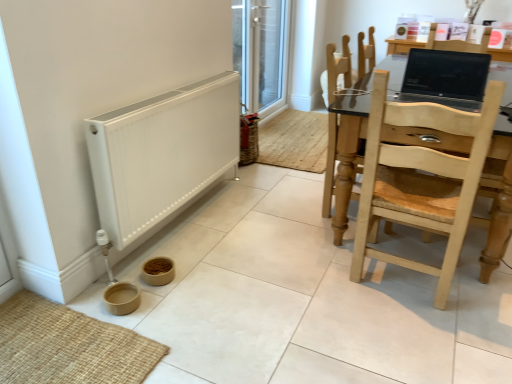
This screenshot has width=512, height=384. Describe the element at coordinates (445, 78) in the screenshot. I see `matte black laptop at upper right` at that location.

What do you see at coordinates (260, 51) in the screenshot? I see `transparent glass screen door at upper center` at bounding box center [260, 51].

Measure the distance between transparent glass screen door at upper center and camera.

The depth of transparent glass screen door at upper center is 10.62 feet.

You are a GUI agent. You are given a task and a screenshot of the screen. Output one action in this format:
    pyautogui.click(x=<x>, y=<y>)
    Task: Click on the light wood chair at right, the first chair in the front-to-back sequence
    The image size is (512, 384).
    Given the screenshot: What is the action you would take?
    pyautogui.click(x=422, y=175)

You are a GUI agent. You are given a task and a screenshot of the screen. Output one action in this format:
    pyautogui.click(x=<x>, y=<y>)
    Task: Click on the white matte heater at lower left
    
    Given the screenshot: What is the action you would take?
    pyautogui.click(x=162, y=155)

In the scene shown: Which is more to the left, light brown wooden chair at right, which is the 2th chair from front to back, or matte black laptop at upper right?

Positioned to the left is light brown wooden chair at right, which is the 2th chair from front to back.

From the picture: Who is shorter, light brown wooden chair at right, which is the 2th chair from front to back, or matte black laptop at upper right?

With less height is matte black laptop at upper right.

From the image's perspective, between light brown wooden chair at right, which is the 2th chair from front to back, and matte black laptop at upper right, who is located below?

light brown wooden chair at right, which is the 2th chair from front to back, appears lower in the image.

Would you say light brown wooden chair at right, which appears as the 1th chair when viewed from the back, is inside or outside matte black laptop at upper right?

light brown wooden chair at right, which appears as the 1th chair when viewed from the back, is not inside matte black laptop at upper right, it's outside.

Based on the photo, how different are the orientations of light wood chair at right, the first chair in the front-to-back sequence, and matte black laptop at upper right in degrees?

They differ by 175 degrees in their facing directions.

Is light wood chair at right, the second chair from the back, surrounding matte black laptop at upper right?

No, light wood chair at right, the second chair from the back, does not contain matte black laptop at upper right.

Who is taller, light wood chair at right, the second chair from the back, or matte black laptop at upper right?

light wood chair at right, the second chair from the back, is taller.

Does light wood chair at right, the first chair in the front-to-back sequence, turn towards matte black laptop at upper right?

Yes, light wood chair at right, the first chair in the front-to-back sequence, is oriented towards matte black laptop at upper right.

Is point (435, 67) closer or farther from the camera than point (426, 134)?

Point (435, 67) is positioned farther from the camera compared to point (426, 134).

Is matte black laptop at upper right to the left of light wood chair at right, the second chair from the back, from the viewer's perspective?

In fact, matte black laptop at upper right is to the right of light wood chair at right, the second chair from the back.

From the image's perspective, between matte black laptop at upper right and light wood chair at right, the first chair in the front-to-back sequence, which one is located above?

matte black laptop at upper right, from the image's perspective.

From a real-world perspective, is matte black laptop at upper right under light wood chair at right, the first chair in the front-to-back sequence?

No, from a real-world perspective, matte black laptop at upper right is not beneath light wood chair at right, the first chair in the front-to-back sequence.

Is matte black laptop at upper right a part of transparent glass screen door at upper center?

No, matte black laptop at upper right is not surrounded by transparent glass screen door at upper center.

Which object is thinner, transparent glass screen door at upper center or matte black laptop at upper right?

With smaller width is transparent glass screen door at upper center.

Considering the relative sizes of transparent glass screen door at upper center and matte black laptop at upper right in the image provided, is transparent glass screen door at upper center smaller than matte black laptop at upper right?

Incorrect, transparent glass screen door at upper center is not smaller in size than matte black laptop at upper right.

From a real-world perspective, is transparent glass screen door at upper center on top of matte black laptop at upper right?

No.

Is transparent glass screen door at upper center turned away from light brown wooden chair at right, which is the 2th chair from front to back?

No, transparent glass screen door at upper center is not facing the opposite direction of light brown wooden chair at right, which is the 2th chair from front to back.

Is transparent glass screen door at upper center positioned before light brown wooden chair at right, which appears as the 1th chair when viewed from the back?

No, transparent glass screen door at upper center is further to the viewer.

Can you confirm if transparent glass screen door at upper center is shorter than light brown wooden chair at right, which appears as the 1th chair when viewed from the back?

No, transparent glass screen door at upper center is not shorter than light brown wooden chair at right, which appears as the 1th chair when viewed from the back.

In the scene shown: From the image's perspective, is transparent glass screen door at upper center positioned above or below light brown wooden chair at right, which is the 2th chair from front to back?

transparent glass screen door at upper center is above light brown wooden chair at right, which is the 2th chair from front to back.

Which of these two, light brown wooden chair at right, which is the 2th chair from front to back, or white matte heater at lower left, stands shorter?

white matte heater at lower left.

From the image's perspective, which is below, light brown wooden chair at right, which is the 2th chair from front to back, or white matte heater at lower left?

white matte heater at lower left appears lower in the image.

Are light brown wooden chair at right, which appears as the 1th chair when viewed from the back, and white matte heater at lower left located far from each other?

No, light brown wooden chair at right, which appears as the 1th chair when viewed from the back, is not far from white matte heater at lower left.

Between point (348, 129) and point (94, 147), which one is positioned behind?

The point (348, 129) is behind.

Which object is thinner, light brown wooden chair at right, which is the 2th chair from front to back, or transparent glass screen door at upper center?

transparent glass screen door at upper center is thinner.

Between light brown wooden chair at right, which is the 2th chair from front to back, and transparent glass screen door at upper center, which one appears on the right side from the viewer's perspective?

From the viewer's perspective, light brown wooden chair at right, which is the 2th chair from front to back, appears more on the right side.

Considering the sizes of objects light brown wooden chair at right, which appears as the 1th chair when viewed from the back, and transparent glass screen door at upper center in the image provided, who is smaller, light brown wooden chair at right, which appears as the 1th chair when viewed from the back, or transparent glass screen door at upper center?

With smaller size is transparent glass screen door at upper center.

Where is `laptop to the right of light brown wooden chair at right, which appears as the 1th chair when viewed from the back`? laptop to the right of light brown wooden chair at right, which appears as the 1th chair when viewed from the back is located at coordinates (445, 78).

The height and width of the screenshot is (384, 512). In order to click on the 2nd chair below the matte black laptop at upper right (from the image's perspective) in this screenshot , I will do `click(422, 175)`.

Considering their positions, is transparent glass screen door at upper center positioned closer to light wood chair at right, the first chair in the front-to-back sequence, than matte black laptop at upper right?

The object closer to light wood chair at right, the first chair in the front-to-back sequence, is matte black laptop at upper right.

Considering their positions, is transparent glass screen door at upper center positioned closer to matte black laptop at upper right than light wood chair at right, the second chair from the back?

light wood chair at right, the second chair from the back.

When comparing their distances from white matte heater at lower left, does light brown wooden chair at right, which is the 2th chair from front to back, or matte black laptop at upper right seem further?

Among the two, matte black laptop at upper right is located further to white matte heater at lower left.

Looking at the image, which one is located closer to matte black laptop at upper right, white matte heater at lower left or light wood chair at right, the first chair in the front-to-back sequence?

Among the two, light wood chair at right, the first chair in the front-to-back sequence, is located nearer to matte black laptop at upper right.

Looking at the image, which one is located closer to light brown wooden chair at right, which is the 2th chair from front to back, matte black laptop at upper right or light wood chair at right, the second chair from the back?

matte black laptop at upper right.

Based on their spatial positions, is transparent glass screen door at upper center or light brown wooden chair at right, which appears as the 1th chair when viewed from the back, further from white matte heater at lower left?

Based on the image, transparent glass screen door at upper center appears to be further to white matte heater at lower left.

When comparing their distances from white matte heater at lower left, does matte black laptop at upper right or transparent glass screen door at upper center seem further?

The object further to white matte heater at lower left is transparent glass screen door at upper center.

When comparing their distances from light wood chair at right, the second chair from the back, does light brown wooden chair at right, which appears as the 1th chair when viewed from the back, or matte black laptop at upper right seem closer?

matte black laptop at upper right.

Locate an element on the screen. Image resolution: width=512 pixels, height=384 pixels. laptop located between white matte heater at lower left and transparent glass screen door at upper center in the depth direction is located at coordinates (445, 78).

Where is `laptop between light wood chair at right, the first chair in the front-to-back sequence, and transparent glass screen door at upper center in the front-back direction`? The width and height of the screenshot is (512, 384). laptop between light wood chair at right, the first chair in the front-to-back sequence, and transparent glass screen door at upper center in the front-back direction is located at coordinates (445, 78).

You are a GUI agent. You are given a task and a screenshot of the screen. Output one action in this format:
    pyautogui.click(x=<x>, y=<y>)
    Task: Click on the chair positioned between light wood chair at right, the first chair in the front-to-back sequence, and transparent glass screen door at upper center from near to far
    This screenshot has height=384, width=512.
    Given the screenshot: What is the action you would take?
    pyautogui.click(x=346, y=136)

The width and height of the screenshot is (512, 384). Identify the location of chair between white matte heater at lower left and transparent glass screen door at upper center in the front-back direction. (346, 136).